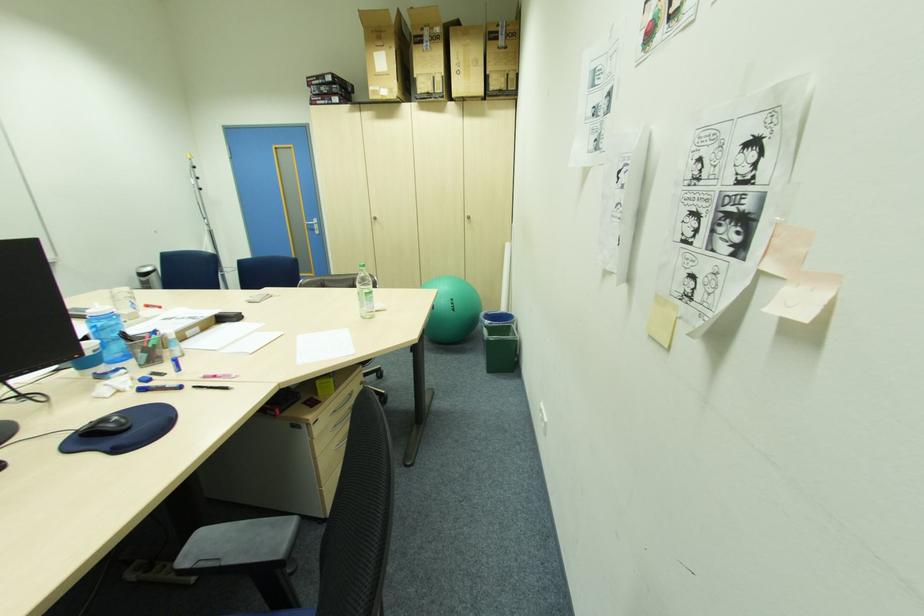
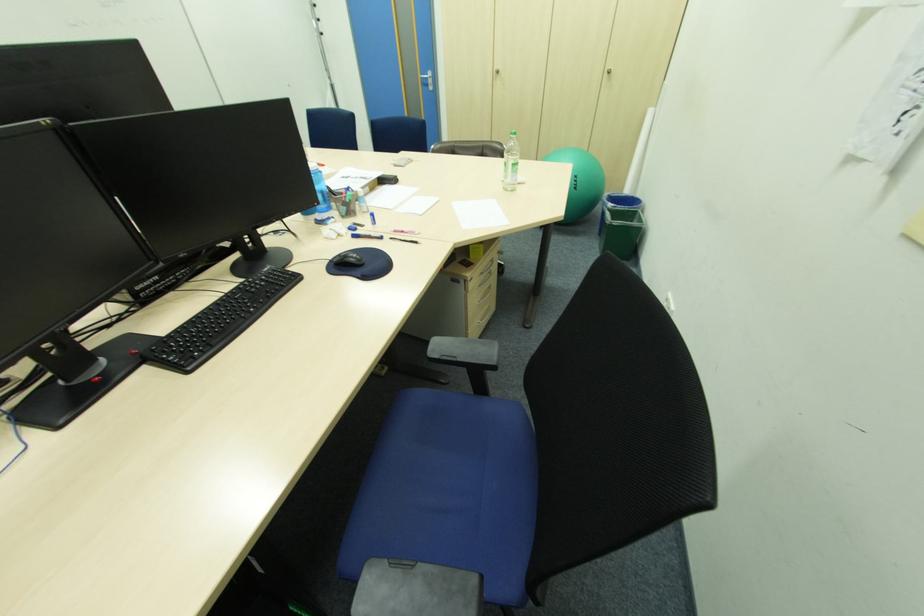
Find the pixel in the second image that matches point (149, 357) in the first image.

(349, 209)